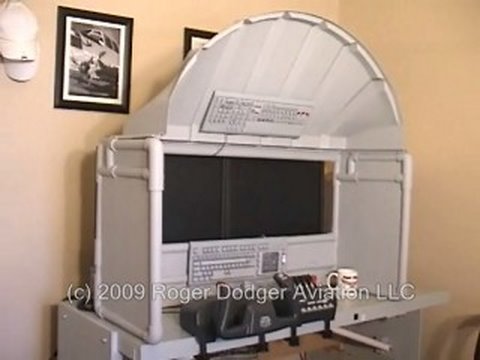
Where is `corner of similar picture frame`? corner of similar picture frame is located at coordinates click(191, 34).